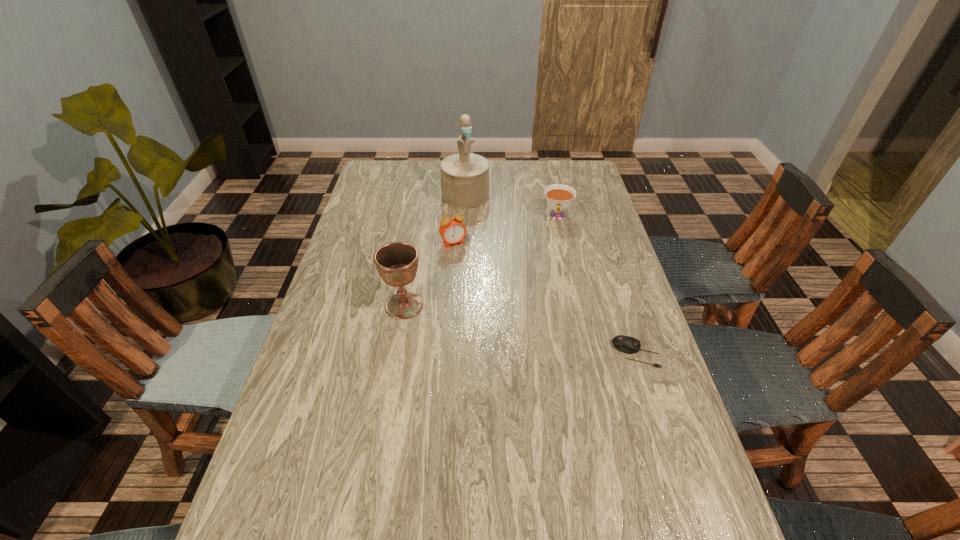
Identify the location of object present at the far edge. (464, 176).

Identify the location of mouse located at the right edge. This screenshot has width=960, height=540. (626, 344).

Where is `teacup that is positioned at the right edge`? teacup that is positioned at the right edge is located at coordinates (559, 197).

Where is `vacant space at the far edge of the desktop`? vacant space at the far edge of the desktop is located at coordinates (417, 181).

The width and height of the screenshot is (960, 540). What are the coordinates of `free space at the near edge of the desktop` in the screenshot? It's located at (430, 488).

Identify the location of free spot at the left edge of the desktop. This screenshot has width=960, height=540. (396, 219).

This screenshot has width=960, height=540. I want to click on free location at the right edge of the desktop, so click(602, 239).

Where is `vacant region at the far left corner of the desktop`? vacant region at the far left corner of the desktop is located at coordinates (388, 180).

This screenshot has width=960, height=540. I want to click on blank area at the near left corner, so click(x=317, y=492).

The image size is (960, 540). I want to click on vacant point at the far right corner, so click(580, 183).